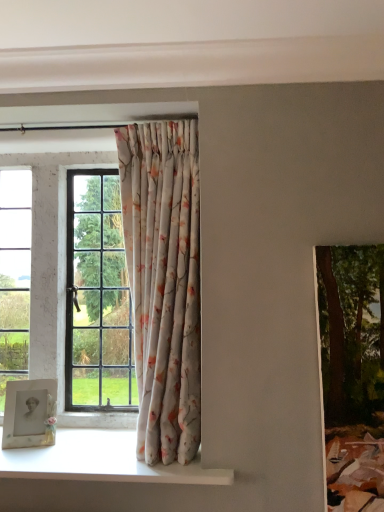
You are a GUI agent. You are given a task and a screenshot of the screen. Output one action in this format:
    pyautogui.click(x=<x>, y=<y>)
    Task: Click on the vacant position to the left of floral fabric curtain at center
    The image size is (384, 512).
    Given the screenshot: What is the action you would take?
    pyautogui.click(x=84, y=457)